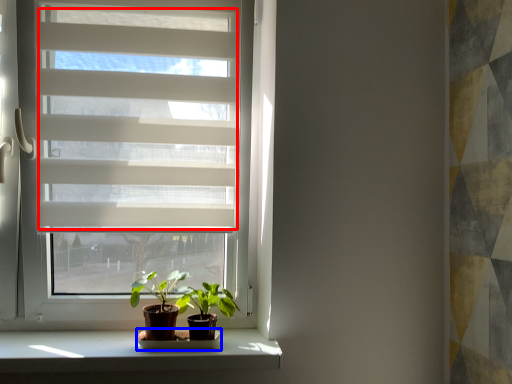
Question: Which object is further to the camera taking this photo, blind (highlighted by a red box) or shelf (highlighted by a blue box)?

Choices:
 (A) blind
 (B) shelf

Answer: (B)